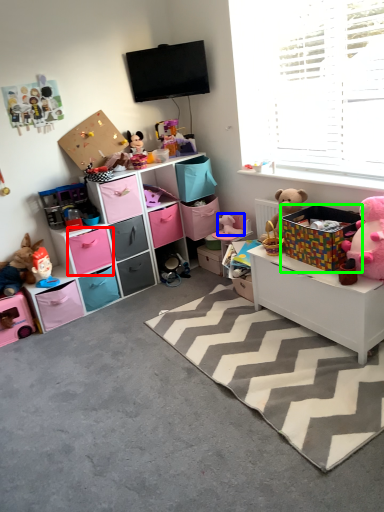
Question: Which object is positioned farthest from drawer (highlighted by a red box)? Select from toy (highlighted by a blue box) and storage box (highlighted by a green box).

Choices:
 (A) toy
 (B) storage box

Answer: (B)